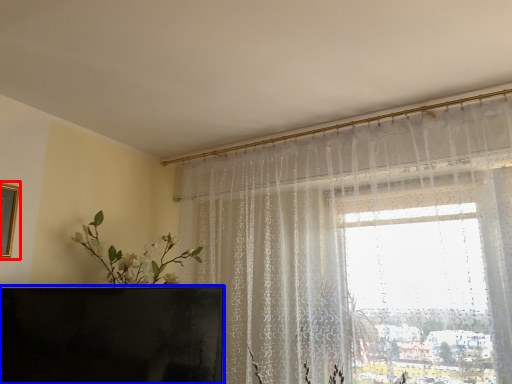
Question: Which object appears closest to the camera in this image, picture frame (highlighted by a red box) or furniture (highlighted by a blue box)?

Choices:
 (A) picture frame
 (B) furniture

Answer: (B)